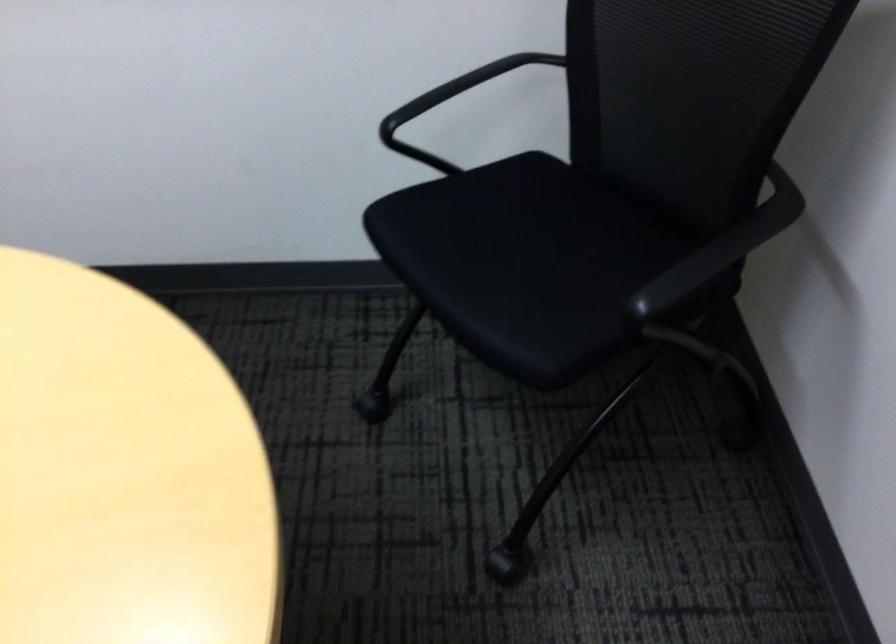
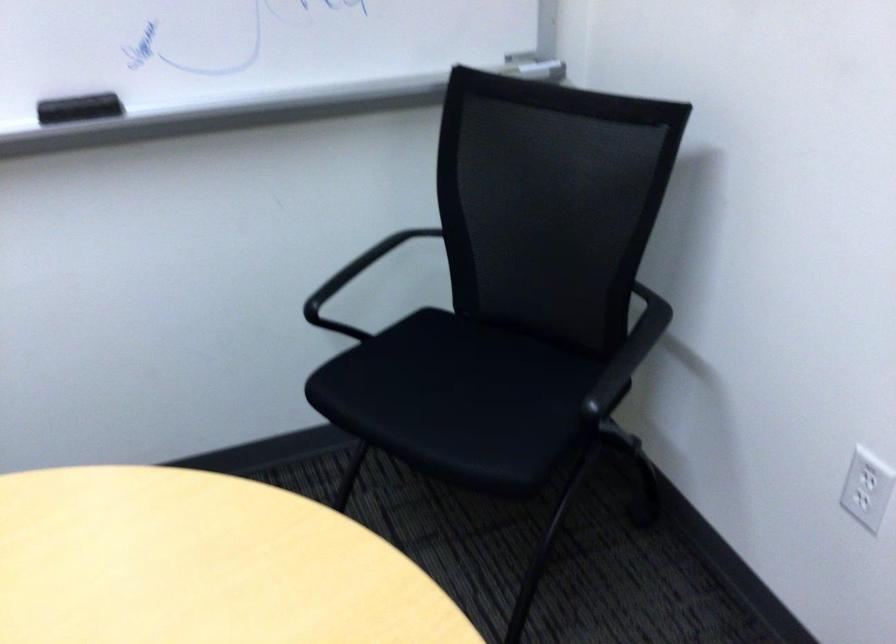
Find the pixel in the second image that matches (x=527, y=269) in the first image.

(460, 401)